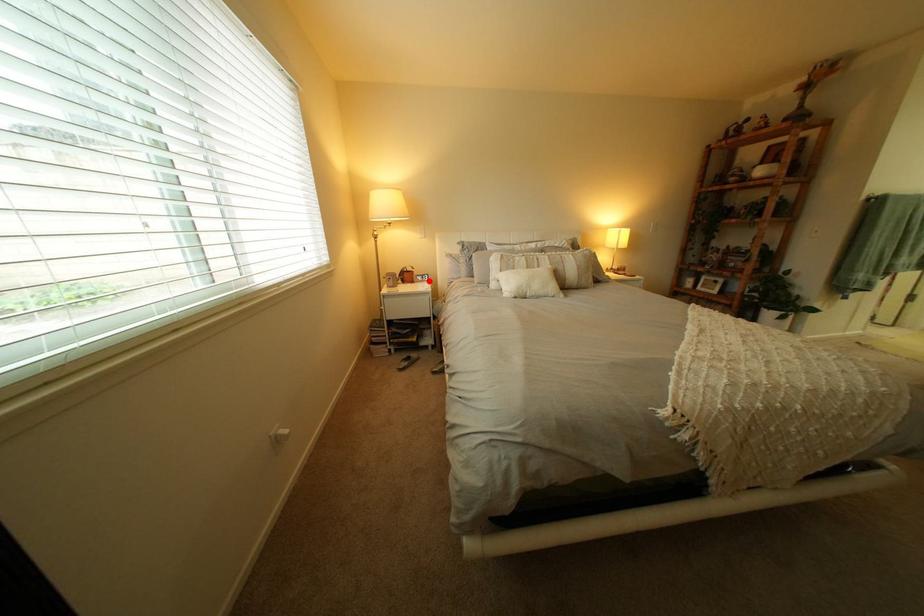
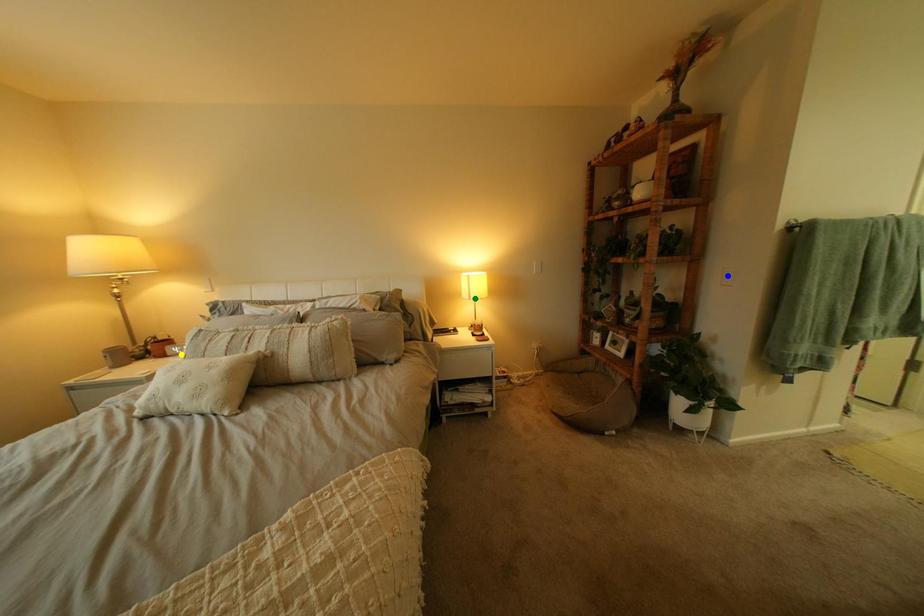
Question: I am providing you with two images of the same scene from different viewpoints. A red point is marked on the first image. You are given multiple points on the second image. Which mark in image 2 goes with the point in image 1?

Choices:
 (A) green point
 (B) yellow point
 (C) blue point

Answer: (B)